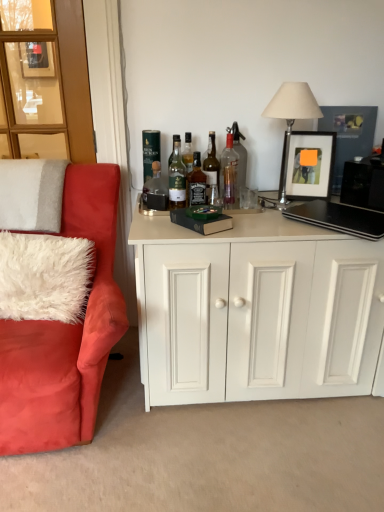
Question: From the image's perspective, is clear glass bottle at center, the second bottle positioned from the right, positioned above or below translucent glass bottle at center, the third bottle in the right-to-left sequence?

Choices:
 (A) below
 (B) above

Answer: (B)

Question: Relative to translucent glass bottle at center, the third bottle in the right-to-left sequence, is clear glass bottle at center, the second bottle positioned from the right, in front or behind?

Choices:
 (A) front
 (B) behind

Answer: (A)

Question: Which object is positioned closest to the wooden glass door at upper left?

Choices:
 (A) matte black picture frame at upper right
 (B) white fluffy pillow at left, the 1th pillow when ordered from bottom to top
 (C) velvet red armchair at left
 (D) translucent glass bottle at center, which appears as the 5th bottle when viewed from the left
 (E) metallic silver table lamp at upper right

Answer: (B)

Question: Which object is the closest to the clear glass bottle at center, which is counted as the 7th bottle, starting from the left?

Choices:
 (A) clear glass bottle at center, the second bottle positioned from the right
 (B) white fluffy pillow at left, positioned as the 2th pillow in bottom-to-top order
 (C) green glass bottle at center, the 3th bottle positioned from the left
 (D) green glass bottle at upper center, which is counted as the 1th bottle, starting from the left
 (E) black matte laptop at right

Answer: (A)